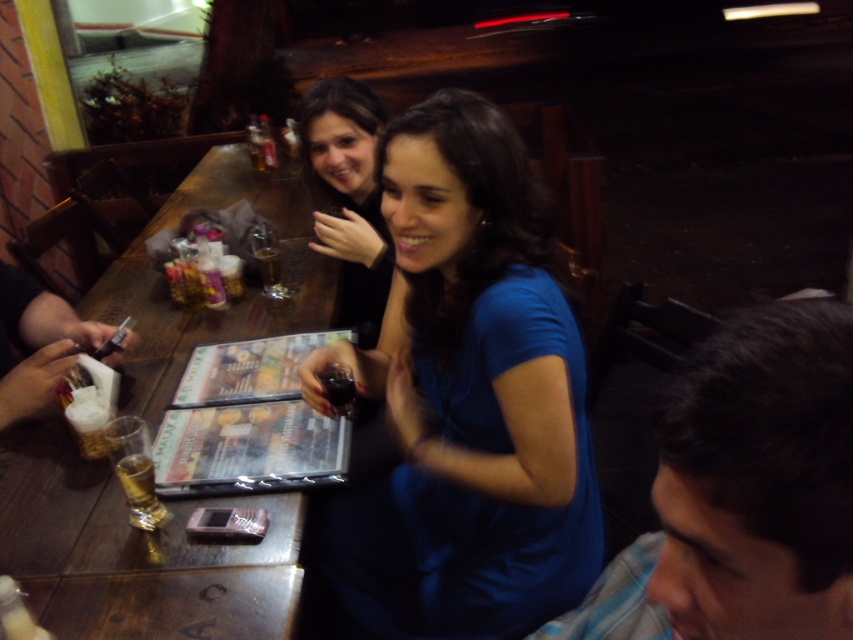
At what (x,y) coordinates should I click in order to perform the action: click on blue matte shirt at center. Please return your answer as a coordinate pair (x, y). The image size is (853, 640). Looking at the image, I should click on click(466, 397).

Is blue matte shirt at center behind matte black dress at center?

No.

Locate an element on the screen. blue matte shirt at center is located at coordinates (466, 397).

Locate an element on the screen. The width and height of the screenshot is (853, 640). blue matte shirt at center is located at coordinates (466, 397).

Locate an element on the screen. The width and height of the screenshot is (853, 640). matte black dress at center is located at coordinates (349, 195).

Does matte black dress at center have a greater height compared to translucent glass wine at table left?

Yes, matte black dress at center is taller than translucent glass wine at table left.

Is point (384, 301) positioned behind point (155, 497)?

Yes, point (384, 301) is farther from viewer.

Find the location of a particular element. This screenshot has height=640, width=853. matte black dress at center is located at coordinates (349, 195).

Is point (460, 445) farther from viewer compared to point (119, 477)?

Yes, point (460, 445) is behind point (119, 477).

Which is in front, point (482, 483) or point (128, 472)?

Positioned in front is point (482, 483).

Is point (422, 515) positioned behind point (154, 512)?

Yes, it is behind point (154, 512).

You are a GUI agent. You are given a task and a screenshot of the screen. Output one action in this format:
    pyautogui.click(x=<x>, y=<y>)
    Task: Click on the blue matte shirt at center
    
    Given the screenshot: What is the action you would take?
    pyautogui.click(x=466, y=397)